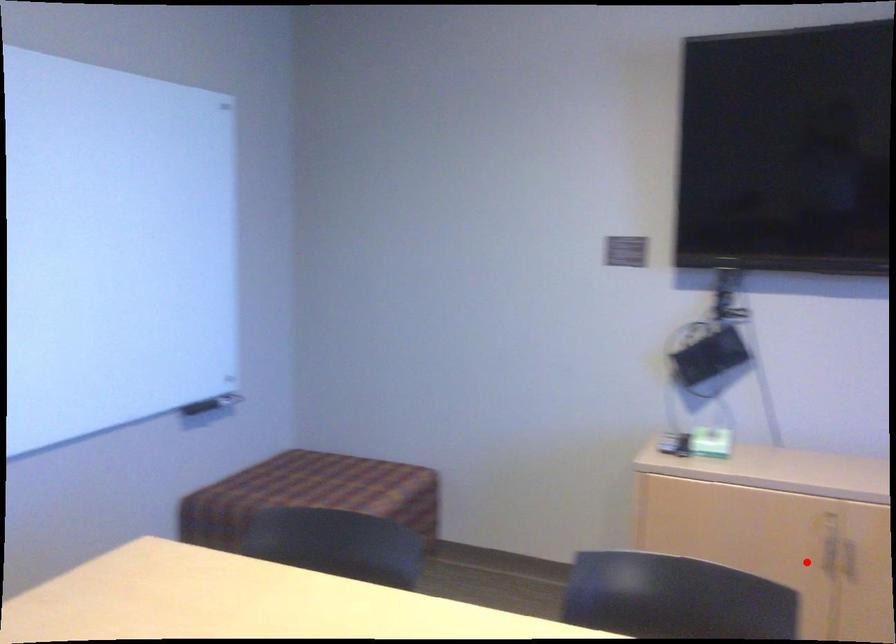
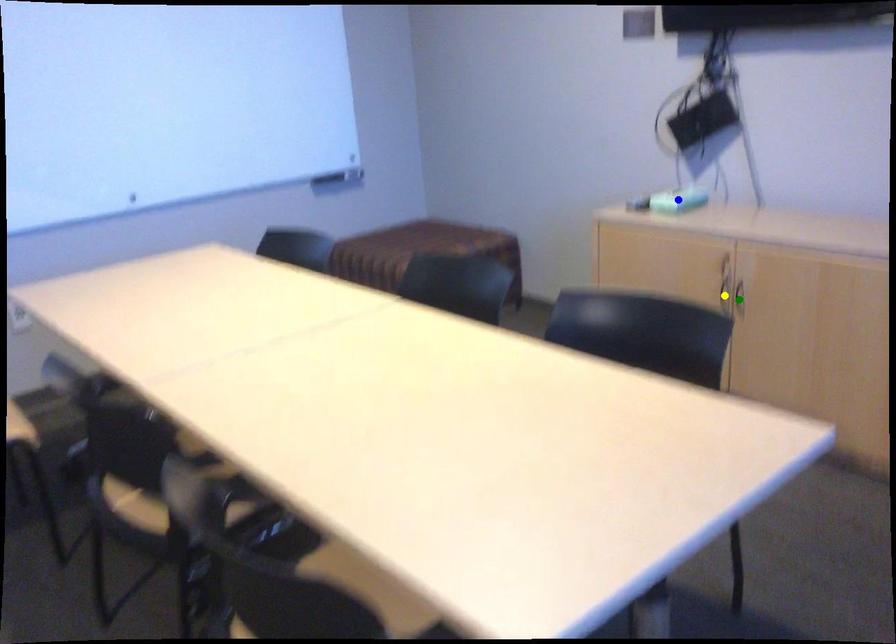
Question: I am providing you with two images of the same scene from different viewpoints. A red point is marked on the first image. You are given multiple points on the second image. Can you choose the point in image 2 that corresponds to the point in image 1?

Choices:
 (A) blue point
 (B) yellow point
 (C) green point

Answer: (B)